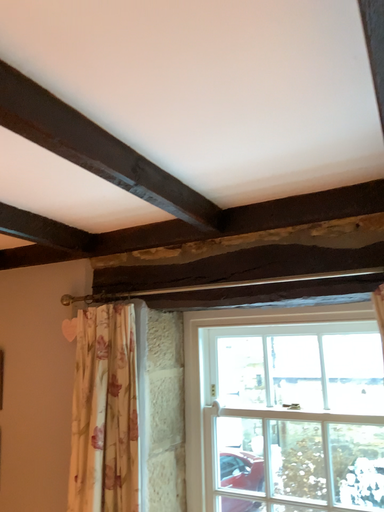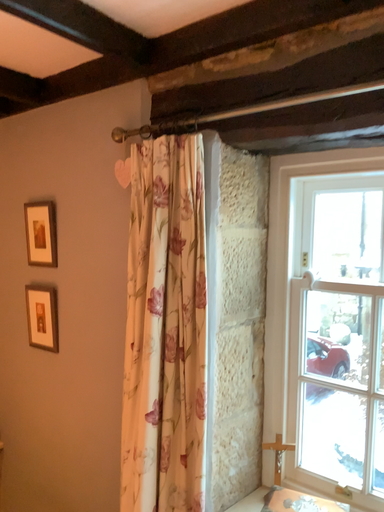
Question: How did the camera likely rotate when shooting the video?

Choices:
 (A) rotated downward
 (B) rotated upward

Answer: (A)